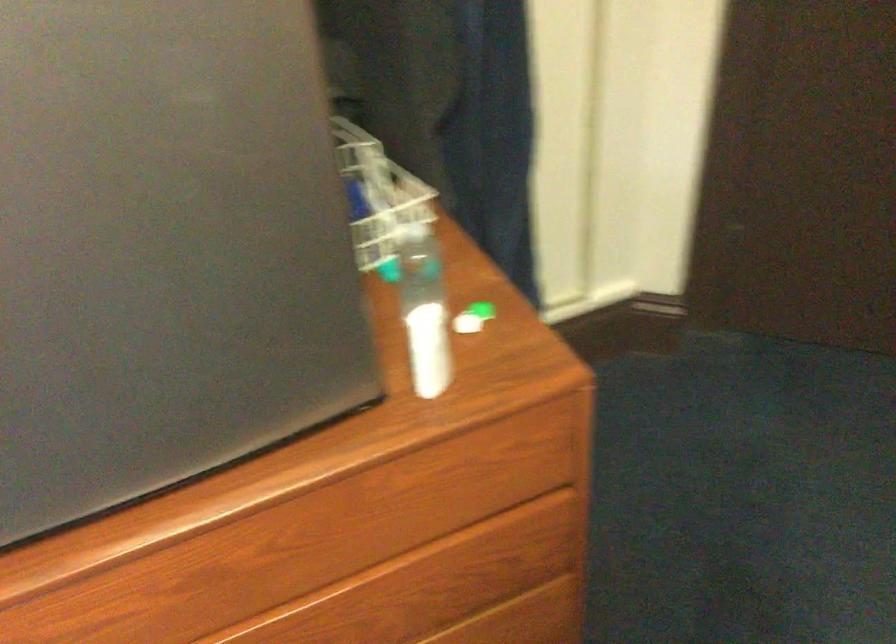
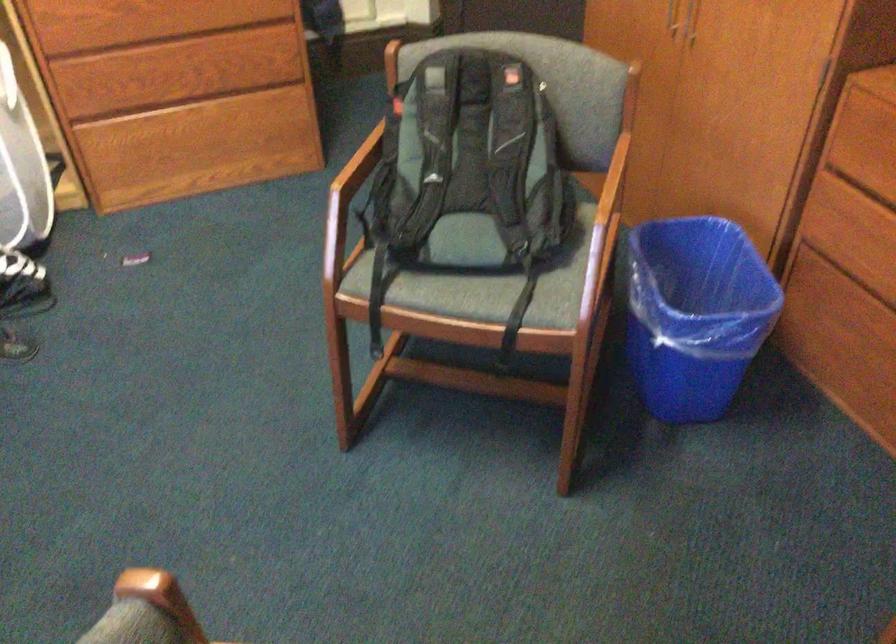
What movement of the cameraman would produce the second image?

The movement direction of the cameraman is right, backward.